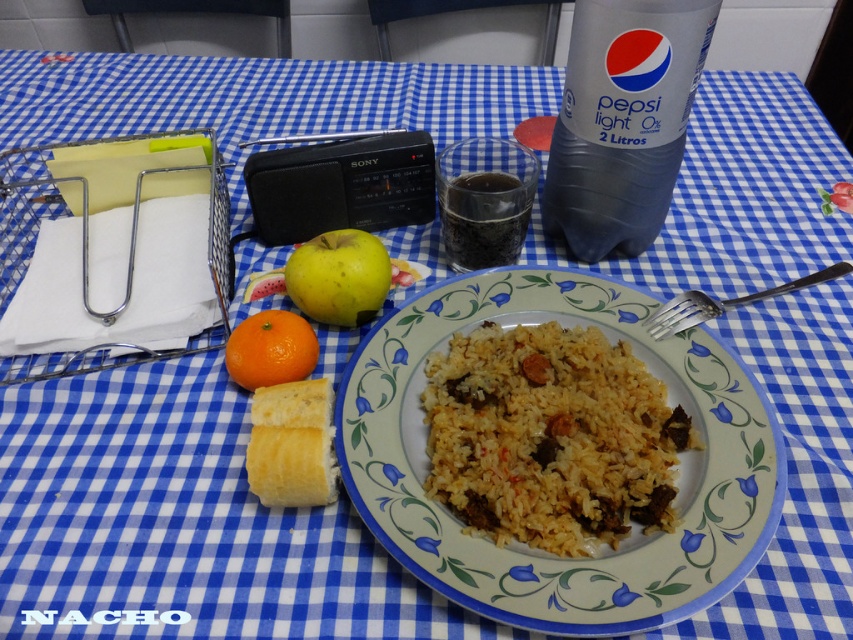
You are arranging items on a table for a picnic. The white glossy plate at center is placed at a specific coordinate. If you want to place a napkin exactly 0.1 units to the right of the plate, what coordinate should you use?

The white glossy plate at center is located at point (540, 548). To place the napkin 0.1 units to the right, add 0.1 to the x coordinate, resulting in (540, 612).